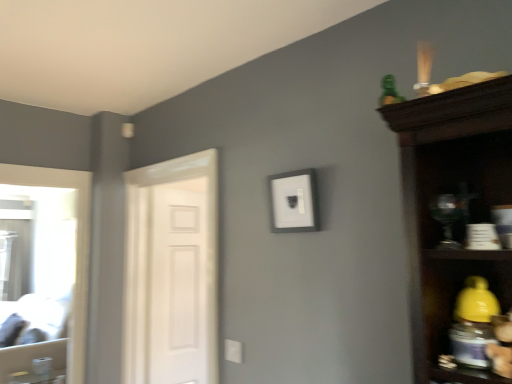
Question: Considering the relative sizes of white matte door at left and green plastic toy at upper right in the image provided, is white matte door at left taller than green plastic toy at upper right?

Choices:
 (A) no
 (B) yes

Answer: (B)

Question: From a real-world perspective, is white matte door at left positioned over green plastic toy at upper right based on gravity?

Choices:
 (A) no
 (B) yes

Answer: (A)

Question: Does white matte door at left have a greater width compared to green plastic toy at upper right?

Choices:
 (A) no
 (B) yes

Answer: (B)

Question: Is green plastic toy at upper right a part of white matte door at left?

Choices:
 (A) yes
 (B) no

Answer: (B)

Question: Is white matte door at left behind green plastic toy at upper right?

Choices:
 (A) no
 (B) yes

Answer: (B)

Question: Considering the relative sizes of white matte door at left and green plastic toy at upper right in the image provided, is white matte door at left shorter than green plastic toy at upper right?

Choices:
 (A) yes
 (B) no

Answer: (B)

Question: Is the depth of green plastic toy at upper right less than that of white matte door at left?

Choices:
 (A) no
 (B) yes

Answer: (B)

Question: Can we say green plastic toy at upper right lies outside white matte door at left?

Choices:
 (A) no
 (B) yes

Answer: (B)

Question: Does green plastic toy at upper right have a lesser width compared to white matte door at left?

Choices:
 (A) no
 (B) yes

Answer: (B)

Question: From the image's perspective, is green plastic toy at upper right located beneath white matte door at left?

Choices:
 (A) no
 (B) yes

Answer: (A)

Question: Is green plastic toy at upper right shorter than white matte door at left?

Choices:
 (A) no
 (B) yes

Answer: (B)

Question: From the image's perspective, is green plastic toy at upper right on top of white matte door at left?

Choices:
 (A) yes
 (B) no

Answer: (A)

Question: Does green plastic toy at upper right appear on the right side of white painted wood door at left?

Choices:
 (A) yes
 (B) no

Answer: (A)